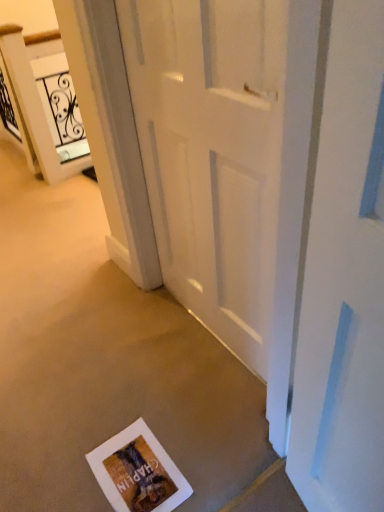
The height and width of the screenshot is (512, 384). What are the coordinates of `free point above matte paper postcard at lower center (from a real-world perspective)` in the screenshot? It's located at (127, 465).